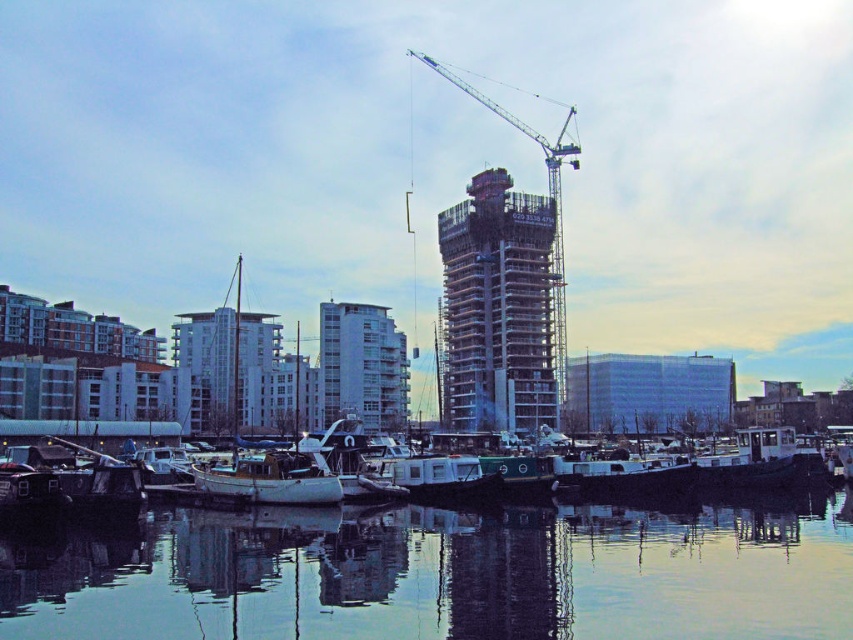
Measure the distance from concrete scaffolding at center to white concrete building at center.

concrete scaffolding at center is 15.67 meters from white concrete building at center.

Find the location of a particular element. concrete scaffolding at center is located at coordinates (498, 307).

Is point (524, 392) behind point (407, 396)?

No, it is not.

You are a GUI agent. You are given a task and a screenshot of the screen. Output one action in this format:
    pyautogui.click(x=<x>, y=<y>)
    Task: Click on the concrete scaffolding at center
    
    Given the screenshot: What is the action you would take?
    pyautogui.click(x=498, y=307)

Which is behind, point (79, 602) or point (323, 385)?

The point (323, 385) is more distant.

Can you confirm if reflective glass water at center is taller than white concrete building at center?

In fact, reflective glass water at center may be shorter than white concrete building at center.

Where is `reflective glass water at center`? This screenshot has height=640, width=853. reflective glass water at center is located at coordinates (444, 576).

Which is behind, point (722, 618) or point (492, 413)?

Positioned behind is point (492, 413).

The width and height of the screenshot is (853, 640). What do you see at coordinates (444, 576) in the screenshot? I see `reflective glass water at center` at bounding box center [444, 576].

At what (x,y) coordinates should I click in order to perform the action: click on reflective glass water at center. Please return your answer as a coordinate pair (x, y). Image resolution: width=853 pixels, height=640 pixels. Looking at the image, I should click on (444, 576).